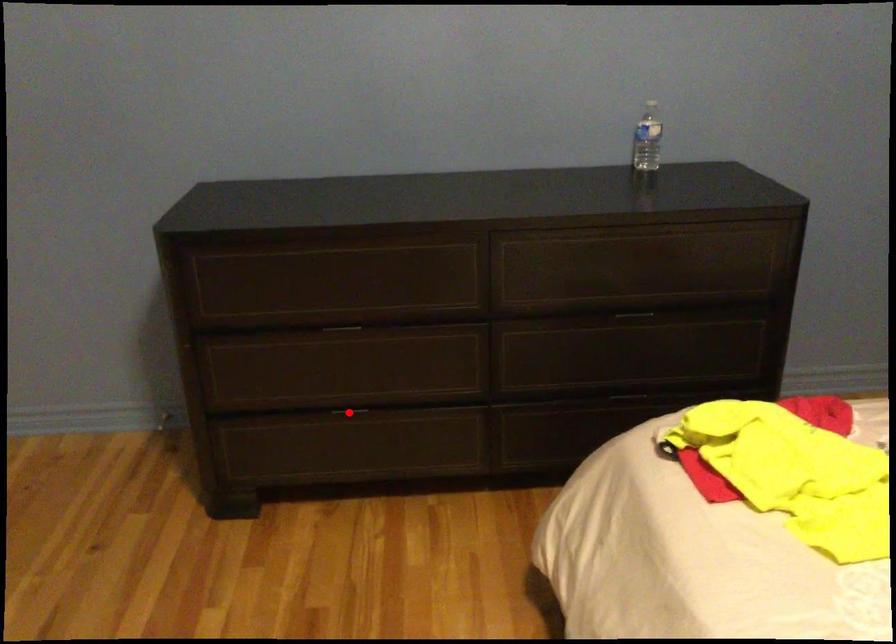
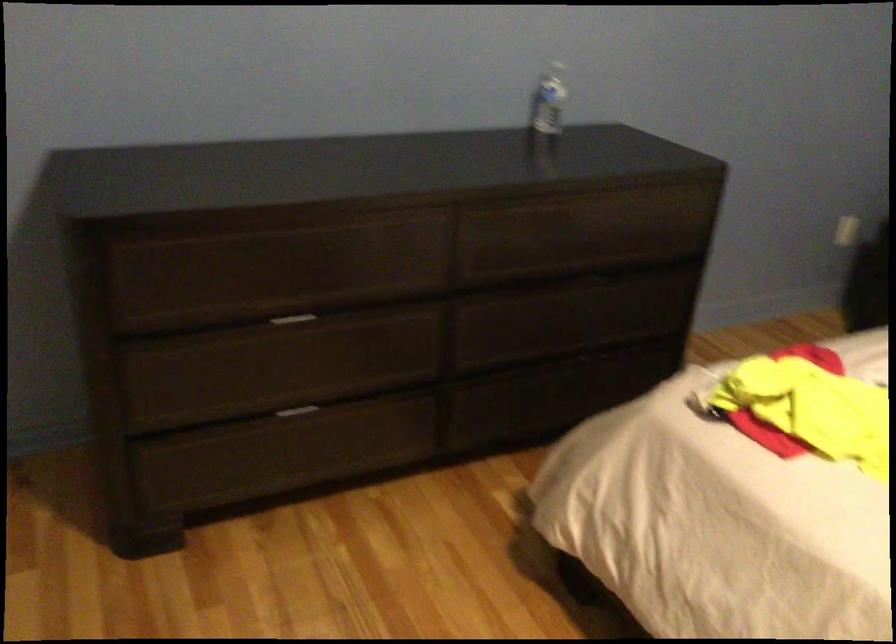
Where in the second image is the point corresponding to the highlighted location from the first image?

(297, 411)